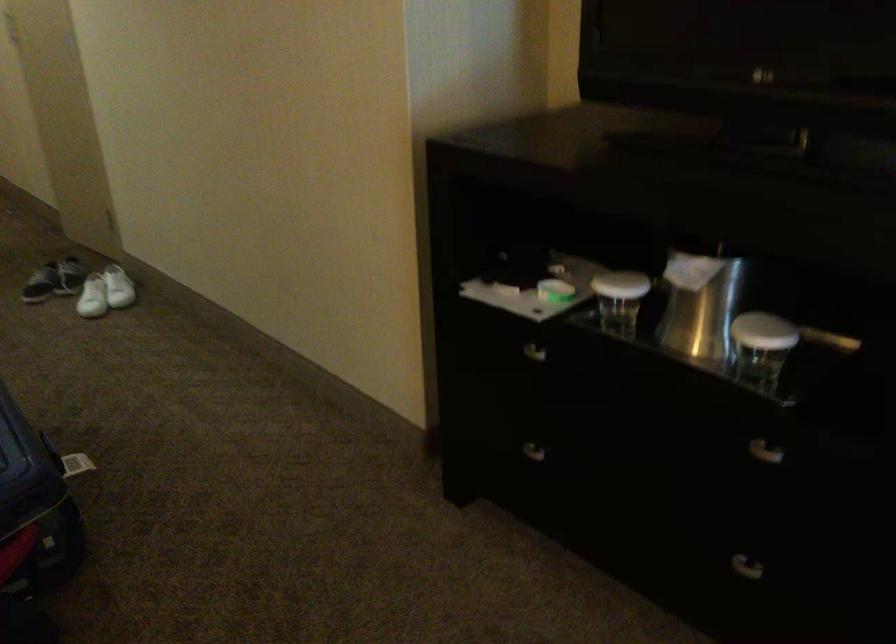
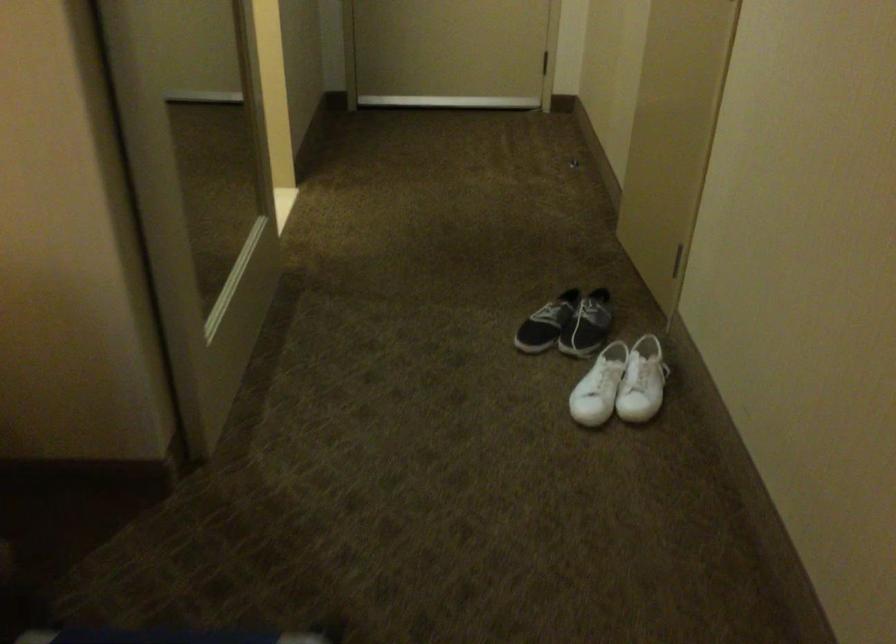
Locate, in the second image, the point that corresponds to pixel 108 285 in the first image.

(642, 382)